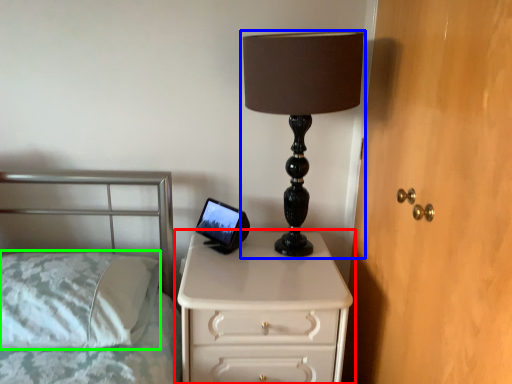
Question: Estimate the real-world distances between objects in this image. Which object is farther from chest of drawers (highlighted by a red box), lamp (highlighted by a blue box) or pillow (highlighted by a green box)?

Choices:
 (A) lamp
 (B) pillow

Answer: (A)